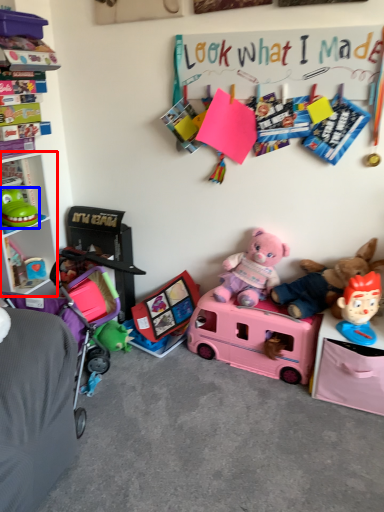
Question: Among these objects, which one is nearest to the camera, cabinet (highlighted by a red box) or toy (highlighted by a blue box)?

Choices:
 (A) cabinet
 (B) toy

Answer: (A)